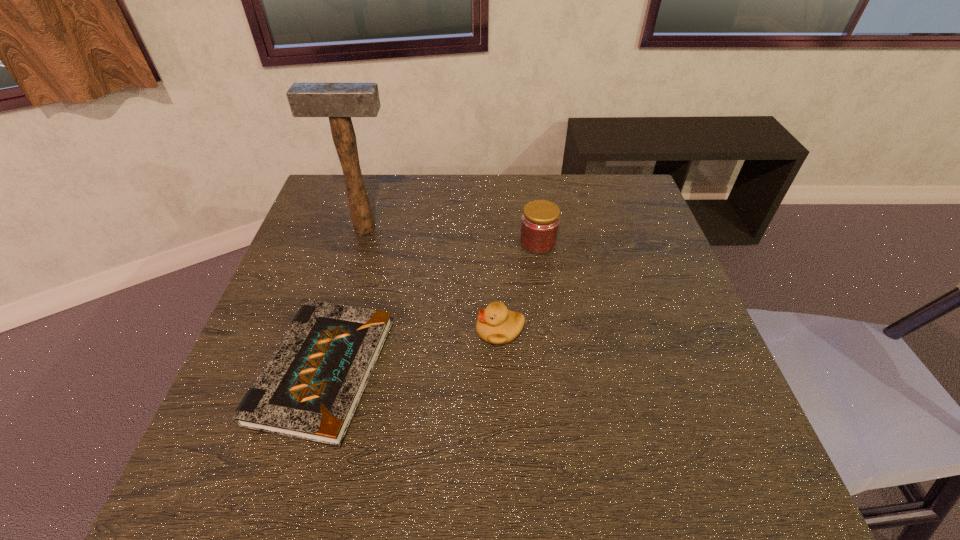
The height and width of the screenshot is (540, 960). What are the coordinates of `vacant space situated at the beak of the third object from left to right` in the screenshot? It's located at (427, 331).

Identify the location of vacant area located on the right of the notebook. click(457, 371).

Where is `mallet located at the left edge`? mallet located at the left edge is located at coordinates (339, 101).

Where is `notebook that is at the left edge`? The height and width of the screenshot is (540, 960). notebook that is at the left edge is located at coordinates (310, 389).

In the image, there is a desktop. Identify the location of vacant area at the far edge. This screenshot has height=540, width=960. (576, 207).

Locate an element on the screen. The image size is (960, 540). free region at the near edge of the desktop is located at coordinates (473, 498).

Image resolution: width=960 pixels, height=540 pixels. In order to click on free spot at the left edge of the desktop in this screenshot , I will do `click(319, 246)`.

In the image, there is a desktop. In order to click on vacant space at the right edge in this screenshot , I will do `click(663, 247)`.

In order to click on free point at the far left corner in this screenshot , I will do `click(325, 187)`.

Identify the location of vacant space at the near left corner of the desktop. (200, 472).